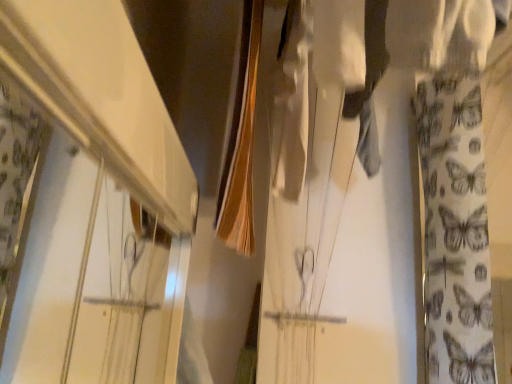
Question: Should I look upward or downward to see white fabric with butterfly pattern at right?

Choices:
 (A) down
 (B) up

Answer: (A)

Question: Is smooth brown fabric at center taller than white glossy shelf at upper left?

Choices:
 (A) no
 (B) yes

Answer: (B)

Question: Does smooth brown fabric at center appear on the left side of white glossy shelf at upper left?

Choices:
 (A) no
 (B) yes

Answer: (A)

Question: Does smooth brown fabric at center lie in front of white glossy shelf at upper left?

Choices:
 (A) no
 (B) yes

Answer: (A)

Question: From a real-world perspective, is smooth brown fabric at center beneath white glossy shelf at upper left?

Choices:
 (A) yes
 (B) no

Answer: (B)

Question: Can we say smooth brown fabric at center lies outside white glossy shelf at upper left?

Choices:
 (A) yes
 (B) no

Answer: (A)

Question: Is smooth brown fabric at center turned away from white glossy shelf at upper left?

Choices:
 (A) no
 (B) yes

Answer: (A)

Question: Considering the relative sizes of white fabric with butterfly pattern at right and white glossy shelf at upper left in the image provided, is white fabric with butterfly pattern at right thinner than white glossy shelf at upper left?

Choices:
 (A) no
 (B) yes

Answer: (A)

Question: Is white fabric with butterfly pattern at right positioned far away from white glossy shelf at upper left?

Choices:
 (A) yes
 (B) no

Answer: (B)

Question: Considering the relative sizes of white fabric with butterfly pattern at right and white glossy shelf at upper left in the image provided, is white fabric with butterfly pattern at right bigger than white glossy shelf at upper left?

Choices:
 (A) no
 (B) yes

Answer: (B)

Question: Does white fabric with butterfly pattern at right have a greater height compared to white glossy shelf at upper left?

Choices:
 (A) yes
 (B) no

Answer: (A)

Question: Is white fabric with butterfly pattern at right positioned beyond the bounds of white glossy shelf at upper left?

Choices:
 (A) no
 (B) yes

Answer: (B)

Question: Does white fabric with butterfly pattern at right come in front of white glossy shelf at upper left?

Choices:
 (A) no
 (B) yes

Answer: (A)

Question: Can you confirm if white glossy shelf at upper left is wider than white fabric with butterfly pattern at right?

Choices:
 (A) no
 (B) yes

Answer: (A)